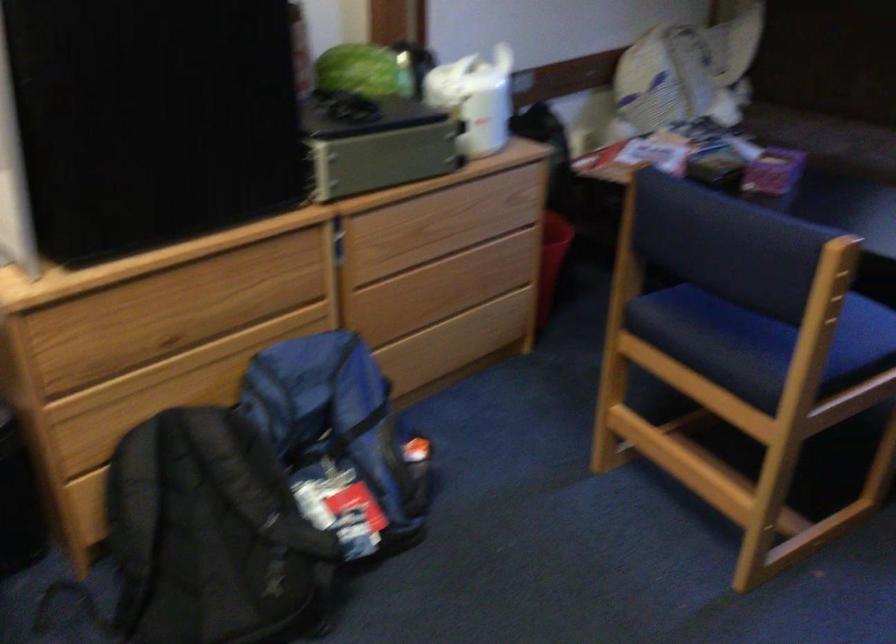
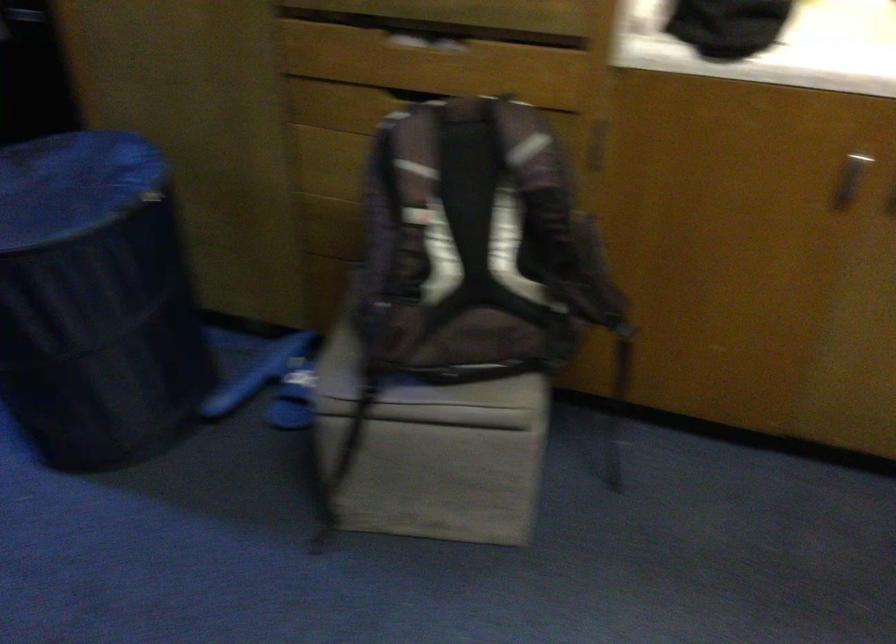
The first image is from the beginning of the video and the second image is from the end. How did the camera likely rotate when shooting the video?

The camera rotated toward right-down.